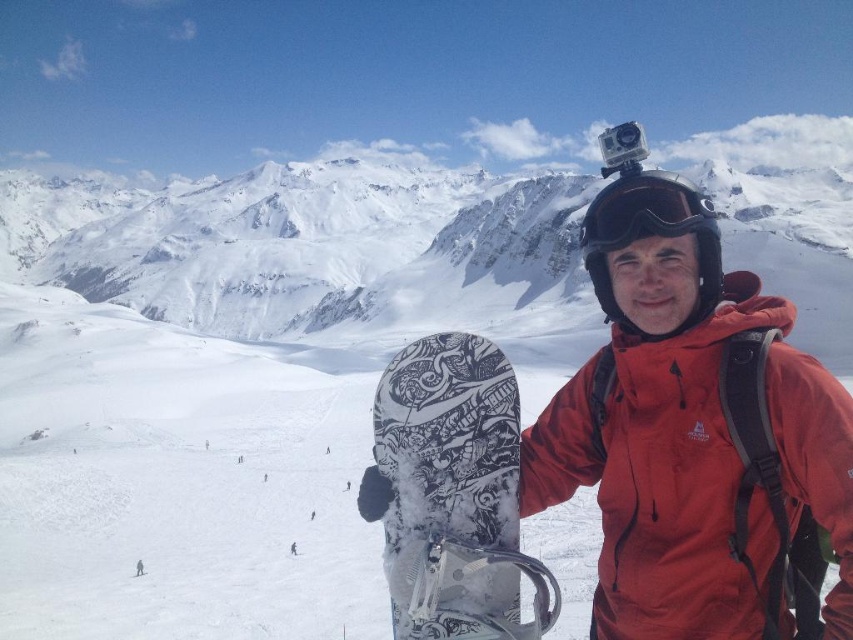
Consider the image. Is white matte snowboard at center below black matte goggles at center?

Yes, white matte snowboard at center is below black matte goggles at center.

Can you confirm if white matte snowboard at center is positioned to the right of black matte goggles at center?

No, white matte snowboard at center is not to the right of black matte goggles at center.

Does point (395, 573) lie in front of point (657, 195)?

Yes, it is in front of point (657, 195).

Identify the location of white matte snowboard at center. click(454, 493).